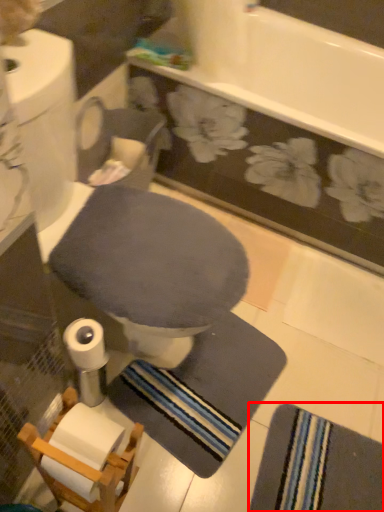
Question: From the image's perspective, considering the relative positions of bath towel (annotated by the red box) and toilet bowl in the image provided, where is bath towel (annotated by the red box) located with respect to the staircase?

Choices:
 (A) above
 (B) below

Answer: (B)